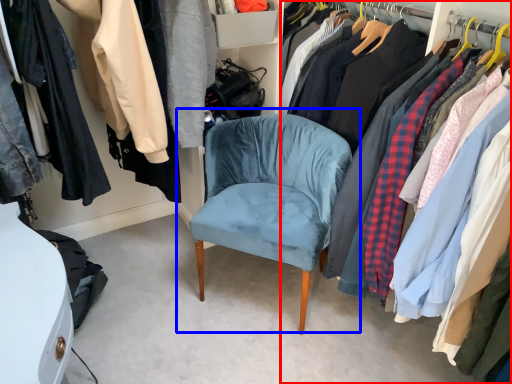
Question: Which object appears farthest to the camera in this image, closet (highlighted by a red box) or chair (highlighted by a blue box)?

Choices:
 (A) closet
 (B) chair

Answer: (B)